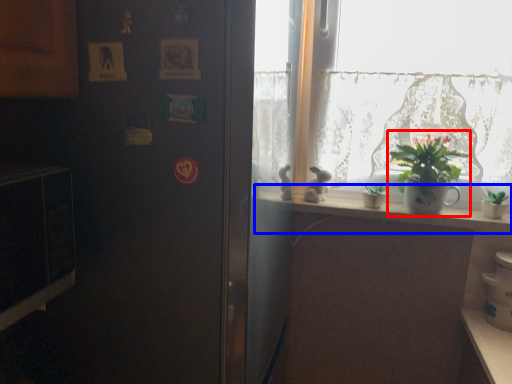
Question: Which point is closer to the camera, houseplant (highlighted by a red box) or window sill (highlighted by a blue box)?

Choices:
 (A) houseplant
 (B) window sill

Answer: (A)